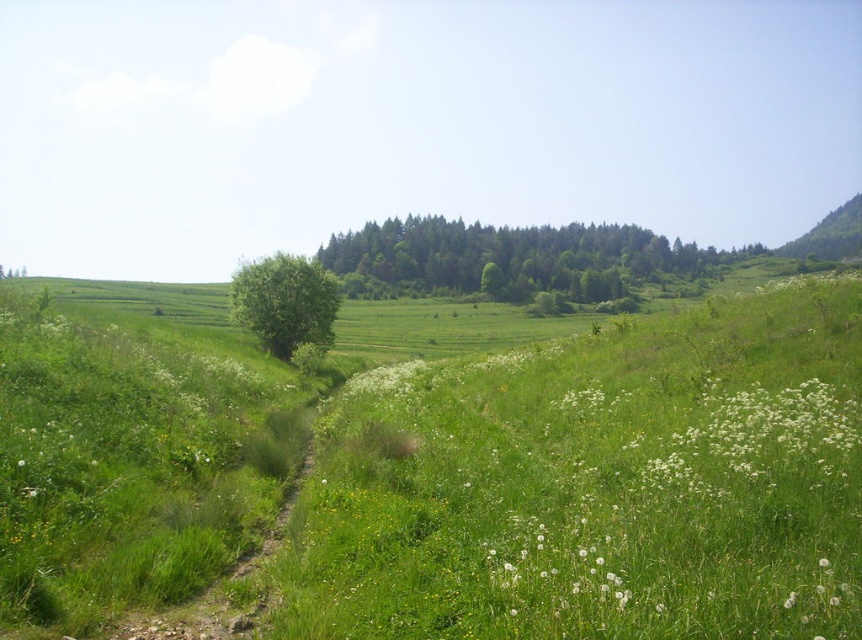
Does green leafy forest at center appear under white fluffy flowers at lower right?

No.

Who is more distant from viewer, [416,230] or [735,448]?

Positioned behind is point [416,230].

Is point (380, 298) positioned behind point (713, 488)?

That is True.

At what (x,y) coordinates should I click in order to perform the action: click on green leafy forest at center. Please return your answer as a coordinate pair (x, y). The image size is (862, 640). Looking at the image, I should click on (511, 259).

Is white fluffy flowers at lower right smaller than white fluffy flower at lower right?

Actually, white fluffy flowers at lower right might be larger than white fluffy flower at lower right.

Which is more to the right, white fluffy flowers at lower right or white fluffy flower at lower right?

white fluffy flowers at lower right is more to the right.

Identify the location of white fluffy flowers at lower right. The image size is (862, 640). (760, 440).

Is point (576, 609) in front of point (801, 416)?

Yes.

I want to click on green grass at center, so click(x=595, y=484).